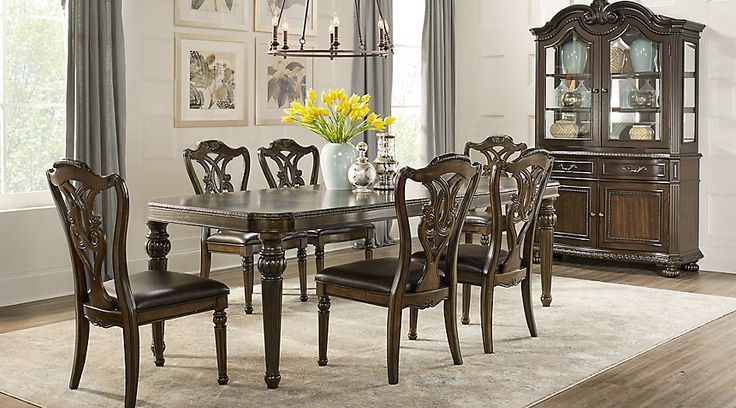
Identify the location of chair backs. (85, 249), (436, 225), (517, 218), (491, 166), (297, 171), (213, 181).